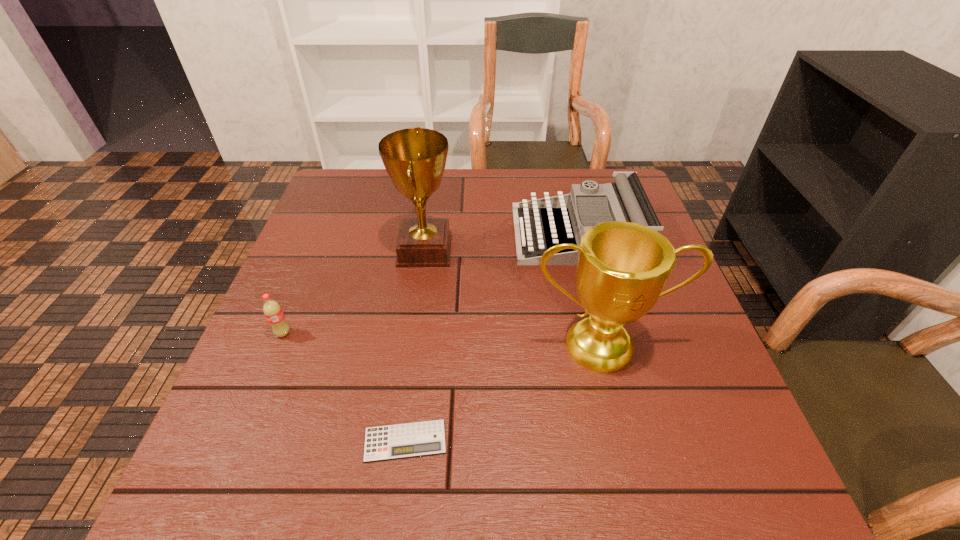
Locate an element on the screen. This screenshot has height=540, width=960. blank space at the near edge of the desktop is located at coordinates (394, 462).

This screenshot has width=960, height=540. I want to click on free space at the left edge, so click(x=340, y=248).

The width and height of the screenshot is (960, 540). I want to click on vacant space at the right edge of the desktop, so click(x=715, y=376).

At what (x,y) coordinates should I click in order to perform the action: click on vacant space at the near left corner of the desktop. Please return your answer as a coordinate pair (x, y). Image resolution: width=960 pixels, height=540 pixels. Looking at the image, I should click on (257, 496).

Image resolution: width=960 pixels, height=540 pixels. In order to click on free region at the far right corner in this screenshot , I will do `click(602, 170)`.

The image size is (960, 540). Find the location of `vacant space that is in between the leftmost object and the typewriter`. vacant space that is in between the leftmost object and the typewriter is located at coordinates (432, 284).

This screenshot has height=540, width=960. What are the coordinates of `vacant area between the shortest object and the right award` in the screenshot? It's located at (503, 393).

The image size is (960, 540). What are the coordinates of `vacant point located between the farther award and the leftmost object` in the screenshot? It's located at (354, 292).

The height and width of the screenshot is (540, 960). In order to click on vacant area between the soda and the shortest object in this screenshot , I will do `click(345, 387)`.

I want to click on vacant space that is in between the nearest object and the farther award, so click(x=415, y=346).